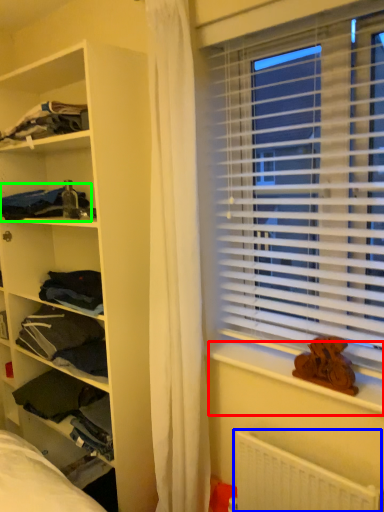
Question: Which object is positioned closest to window sill (highlighted by a red box)? Select from radiator (highlighted by a blue box) and clothing (highlighted by a green box).

Choices:
 (A) radiator
 (B) clothing

Answer: (A)